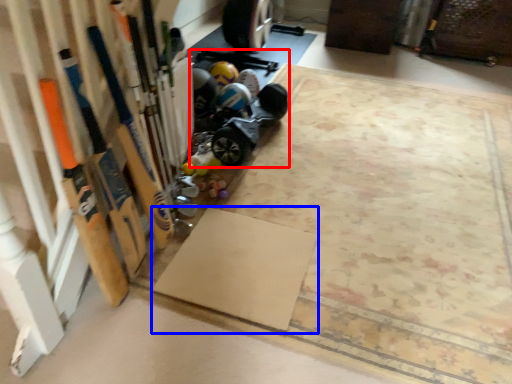
Question: Among these objects, which one is farthest to the camera, car (highlighted by a red box) or yoga mat (highlighted by a blue box)?

Choices:
 (A) car
 (B) yoga mat

Answer: (A)